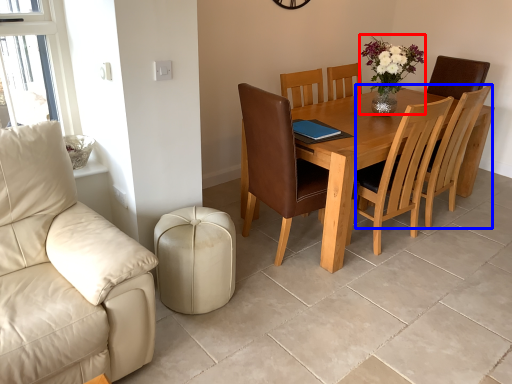
Question: Which object is closer to the camera taking this photo, floral arrangement (highlighted by a red box) or chair (highlighted by a blue box)?

Choices:
 (A) floral arrangement
 (B) chair

Answer: (A)